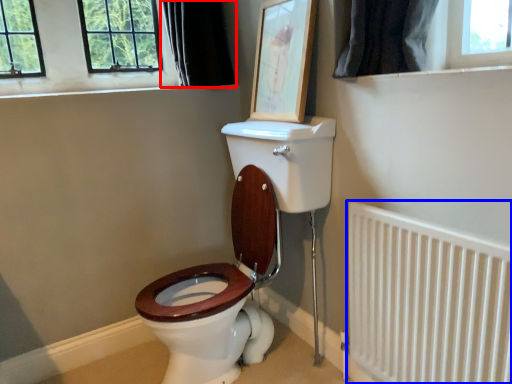
Question: Among these objects, which one is farthest to the camera, curtain (highlighted by a red box) or radiator (highlighted by a blue box)?

Choices:
 (A) curtain
 (B) radiator

Answer: (A)